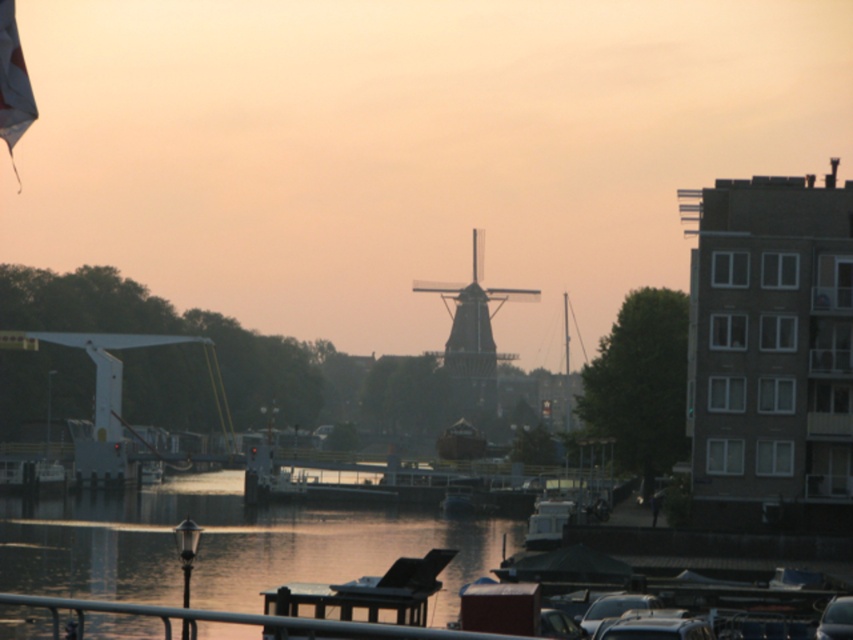
Is silvery reflective water at center below wooden windmill at center?

Indeed, silvery reflective water at center is positioned under wooden windmill at center.

Between point (15, 528) and point (463, 381), which one is positioned in front?

Point (15, 528) is in front.

At what (x,y) coordinates should I click in order to perform the action: click on silvery reflective water at center. Please return your answer as a coordinate pair (x, y). Looking at the image, I should click on (223, 545).

The image size is (853, 640). What do you see at coordinates (473, 332) in the screenshot?
I see `wooden windmill at center` at bounding box center [473, 332].

This screenshot has height=640, width=853. I want to click on wooden windmill at center, so click(473, 332).

Is point (117, 545) behind point (212, 611)?

That is True.

Does silvery reflective water at center come in front of metallic gray rail at lower center?

No, silvery reflective water at center is behind metallic gray rail at lower center.

Between point (47, 528) and point (129, 604), which one is positioned in front?

Point (129, 604) is more forward.

The height and width of the screenshot is (640, 853). Find the location of `silvery reflective water at center`. silvery reflective water at center is located at coordinates (223, 545).